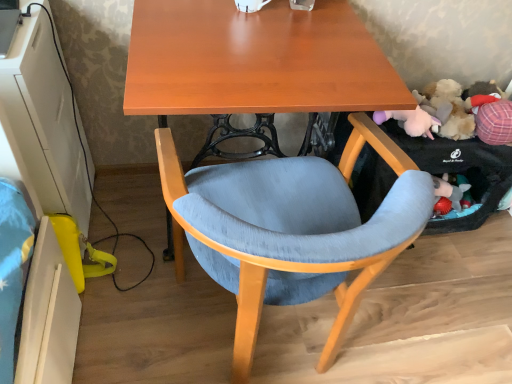
Find the location of a particular element. The width and height of the screenshot is (512, 384). white glossy computer desk at lower left is located at coordinates (42, 123).

The width and height of the screenshot is (512, 384). What do you see at coordinates (278, 256) in the screenshot? I see `textured fabric chair at center` at bounding box center [278, 256].

Measure the distance between point (x=180, y=51) and camera.

A distance of 1.05 meters exists between point (x=180, y=51) and camera.

Image resolution: width=512 pixels, height=384 pixels. What do you see at coordinates (254, 61) in the screenshot? I see `matte wood desk at center` at bounding box center [254, 61].

Identify the location of white glossy computer desk at lower left. (42, 123).

From a real-world perspective, is fluffy plush toy at right positioned under white glossy computer desk at lower left based on gravity?

No.

Is fluffy plush toy at right positioned beyond the bounds of white glossy computer desk at lower left?

fluffy plush toy at right is positioned outside white glossy computer desk at lower left.

From the picture: Which of these two, fluffy plush toy at right or white glossy computer desk at lower left, is smaller?

Smaller between the two is fluffy plush toy at right.

From the image's perspective, does fluffy plush toy at right appear higher than white glossy computer desk at lower left?

Correct, fluffy plush toy at right appears higher than white glossy computer desk at lower left in the image.

Is point (329, 236) positioned behind point (224, 77)?

No, it is not.

In the scene shown: Is textured fabric chair at center next to matte wood desk at center?

No, textured fabric chair at center is not with matte wood desk at center.

Can you tell me how much textured fabric chair at center and matte wood desk at center differ in facing direction?

The angle between the facing direction of textured fabric chair at center and the facing direction of matte wood desk at center is 180 degrees.

Can you confirm if textured fabric chair at center is bigger than matte wood desk at center?

Incorrect, textured fabric chair at center is not larger than matte wood desk at center.

Considering the relative sizes of matte wood desk at center and textured fabric chair at center in the image provided, is matte wood desk at center thinner than textured fabric chair at center?

Incorrect, the width of matte wood desk at center is not less than that of textured fabric chair at center.

From the image's perspective, is matte wood desk at center positioned above or below textured fabric chair at center?

Based on their image positions, matte wood desk at center is located above textured fabric chair at center.

Is matte wood desk at center in front of textured fabric chair at center?

That is False.

Locate an element on the screen. This screenshot has height=384, width=512. desk that is behind the textured fabric chair at center is located at coordinates (254, 61).

From the image's perspective, which one is positioned higher, textured fabric chair at center or fluffy plush toy at right?

fluffy plush toy at right appears higher in the image.

From a real-world perspective, between textured fabric chair at center and fluffy plush toy at right, who is vertically lower?

textured fabric chair at center.

Does textured fabric chair at center turn towards fluffy plush toy at right?

No, textured fabric chair at center is not turned towards fluffy plush toy at right.

Which is correct: textured fabric chair at center is inside fluffy plush toy at right, or outside of it?

textured fabric chair at center is outside fluffy plush toy at right.

Is point (160, 48) positioned behind point (442, 117)?

No, (160, 48) is in front of (442, 117).

In order to click on toy that appears above the matte wood desk at center (from the image's perspective) in this screenshot , I will do `click(447, 109)`.

Considering the relative sizes of matte wood desk at center and fluffy plush toy at right in the image provided, is matte wood desk at center thinner than fluffy plush toy at right?

In fact, matte wood desk at center might be wider than fluffy plush toy at right.

Is matte wood desk at center taller or shorter than fluffy plush toy at right?

Clearly, matte wood desk at center is taller compared to fluffy plush toy at right.

Does fluffy plush toy at right appear on the right side of textured fabric chair at center?

Yes.

Is fluffy plush toy at right in front of or behind textured fabric chair at center in the image?

In the image, fluffy plush toy at right appears behind textured fabric chair at center.

Is fluffy plush toy at right thinner than textured fabric chair at center?

Correct, the width of fluffy plush toy at right is less than that of textured fabric chair at center.

Where is `chair in front of the fluffy plush toy at right`? The height and width of the screenshot is (384, 512). chair in front of the fluffy plush toy at right is located at coordinates (278, 256).

From the picture: Can you confirm if white glossy computer desk at lower left is thinner than matte wood desk at center?

Correct, the width of white glossy computer desk at lower left is less than that of matte wood desk at center.

Is there a large distance between white glossy computer desk at lower left and matte wood desk at center?

No, white glossy computer desk at lower left is not far from matte wood desk at center.

I want to click on computer desk that is above the matte wood desk at center (from the image's perspective), so click(x=42, y=123).

Measure the distance from white glossy computer desk at lower left to matte wood desk at center.

A distance of 19.43 inches exists between white glossy computer desk at lower left and matte wood desk at center.

Where is `computer desk located on the left of fluffy plush toy at right`? computer desk located on the left of fluffy plush toy at right is located at coordinates (42, 123).

Find the location of `desk behind the textured fabric chair at center`. desk behind the textured fabric chair at center is located at coordinates coord(254,61).

Based on the photo, when comparing their distances from fluffy plush toy at right, does textured fabric chair at center or white glossy computer desk at lower left seem closer?

textured fabric chair at center lies closer to fluffy plush toy at right than the other object.

Considering their positions, is white glossy computer desk at lower left positioned closer to fluffy plush toy at right than matte wood desk at center?

matte wood desk at center is closer to fluffy plush toy at right.

Considering their positions, is fluffy plush toy at right positioned closer to matte wood desk at center than textured fabric chair at center?

Among the two, textured fabric chair at center is located nearer to matte wood desk at center.

Looking at the image, which one is located closer to textured fabric chair at center, white glossy computer desk at lower left or matte wood desk at center?

matte wood desk at center lies closer to textured fabric chair at center than the other object.

From the image, which object appears to be nearer to matte wood desk at center, white glossy computer desk at lower left or fluffy plush toy at right?

Among the two, white glossy computer desk at lower left is located nearer to matte wood desk at center.

Based on their spatial positions, is white glossy computer desk at lower left or textured fabric chair at center further from fluffy plush toy at right?

white glossy computer desk at lower left.

Which object lies further to the anchor point white glossy computer desk at lower left, textured fabric chair at center or matte wood desk at center?

Based on the image, textured fabric chair at center appears to be further to white glossy computer desk at lower left.

When comparing their distances from textured fabric chair at center, does matte wood desk at center or white glossy computer desk at lower left seem closer?

matte wood desk at center is closer to textured fabric chair at center.

Locate an element on the screen. The height and width of the screenshot is (384, 512). desk located between white glossy computer desk at lower left and textured fabric chair at center in the left-right direction is located at coordinates (254, 61).

The image size is (512, 384). In order to click on desk between white glossy computer desk at lower left and fluffy plush toy at right in the horizontal direction in this screenshot , I will do `click(254, 61)`.

Identify the location of chair between white glossy computer desk at lower left and fluffy plush toy at right in the horizontal direction. The height and width of the screenshot is (384, 512). coord(278,256).

This screenshot has height=384, width=512. Find the location of `chair between matte wood desk at center and fluffy plush toy at right in the horizontal direction`. chair between matte wood desk at center and fluffy plush toy at right in the horizontal direction is located at coordinates (278, 256).